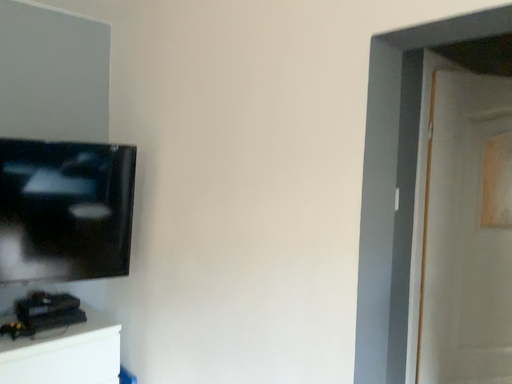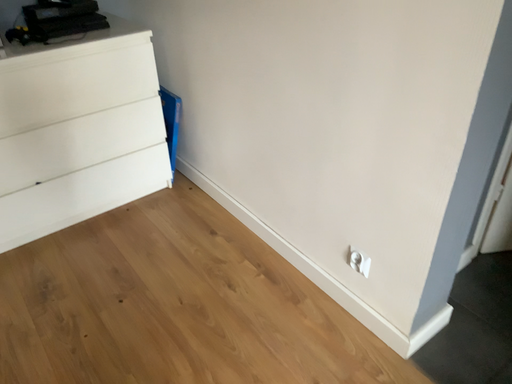
Question: How did the camera likely rotate when shooting the video?

Choices:
 (A) rotated downward
 (B) rotated upward

Answer: (A)